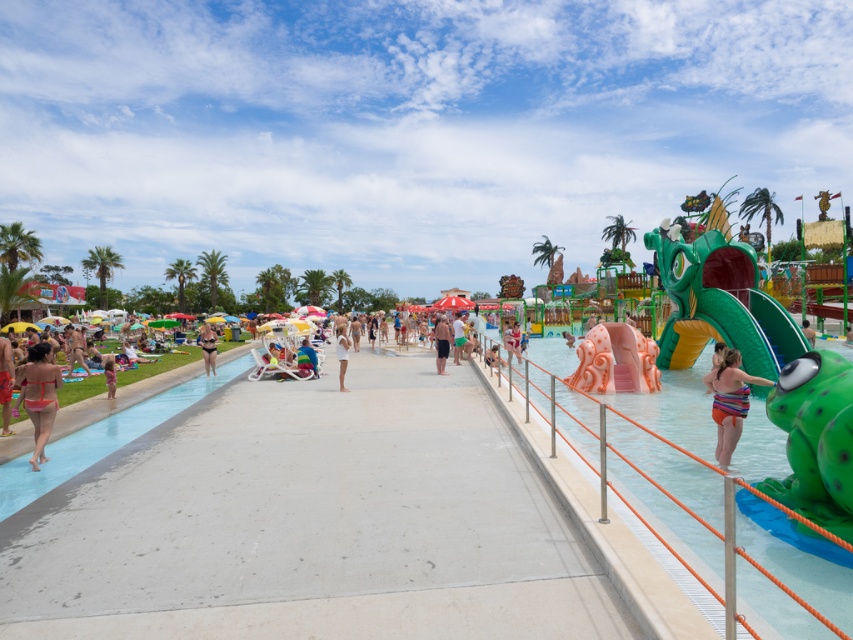
Question: Does matte orange bikini at left have a larger size compared to matte black shorts at center?

Choices:
 (A) yes
 (B) no

Answer: (B)

Question: Among these points, which one is farthest from the camera?

Choices:
 (A) (763, 419)
 (B) (32, 420)
 (C) (70, 435)
 (D) (599, 340)

Answer: (D)

Question: Which object is closer to the camera taking this photo?

Choices:
 (A) white cotton towel at center
 (B) matte black bikini at center
 (C) matte orange bikini at left

Answer: (C)

Question: Estimate the real-world distances between objects in this image. Which object is farther from the tan skin person at left?

Choices:
 (A) white cotton towel at center
 (B) matte black shorts at center

Answer: (A)

Question: Does matte orange bikini at left have a greater width compared to tan skin person at left?

Choices:
 (A) no
 (B) yes

Answer: (A)

Question: Is matte orange bikini at left to the right of matte black shorts at center from the viewer's perspective?

Choices:
 (A) yes
 (B) no

Answer: (B)